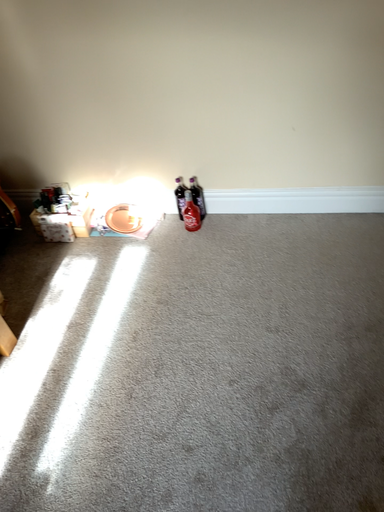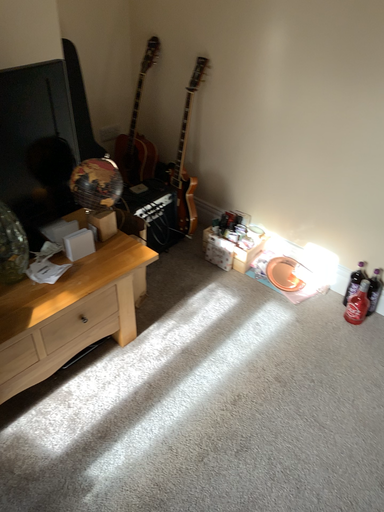
Question: Which way did the camera rotate in the video?

Choices:
 (A) rotated left
 (B) rotated right

Answer: (A)